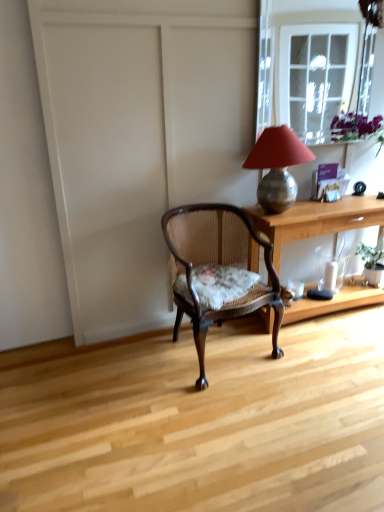
Question: Based on their positions, is clear glass window at upper right located to the left or right of wooden desk at center?

Choices:
 (A) right
 (B) left

Answer: (B)

Question: Is clear glass window at upper right inside or outside of wooden desk at center?

Choices:
 (A) outside
 (B) inside

Answer: (A)

Question: Considering the real-world distances, which object is farthest from the metallic lampshade at upper right?

Choices:
 (A) green leafy plant at right
 (B) wooden desk at center
 (C) clear glass window at upper right
 (D) wooden cane chair with floral cushion at center
 (E) transparent glass vase at lower right

Answer: (C)

Question: Which object is positioned closest to the wooden cane chair with floral cushion at center?

Choices:
 (A) clear glass window at upper right
 (B) green leafy plant at right
 (C) metallic lampshade at upper right
 (D) transparent glass vase at lower right
 (E) wooden desk at center

Answer: (E)